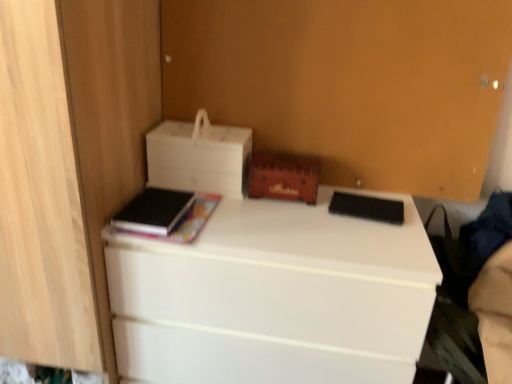
Where is `vacant space behind black matte paperback book at center, the 2th paperback book when ordered from left to right`? The width and height of the screenshot is (512, 384). vacant space behind black matte paperback book at center, the 2th paperback book when ordered from left to right is located at coordinates (364, 190).